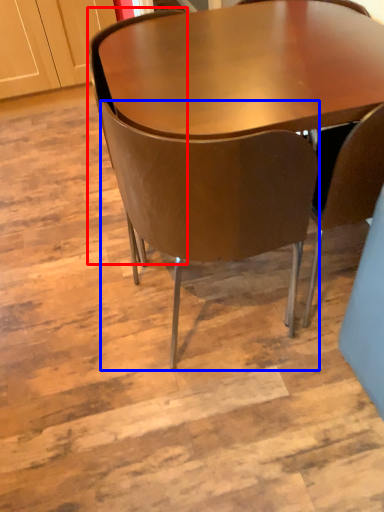
Question: Which of the following is the farthest to the observer, chair (highlighted by a red box) or chair (highlighted by a blue box)?

Choices:
 (A) chair
 (B) chair

Answer: (A)